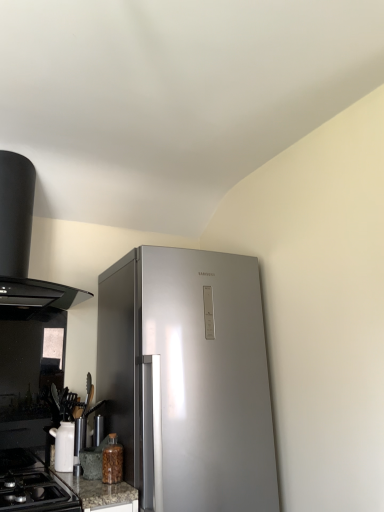
Question: From the image's perspective, is translucent glass jar at lower left above or below black matte range hood at upper left?

Choices:
 (A) above
 (B) below

Answer: (B)

Question: Is translucent glass jar at lower left in front of or behind black matte range hood at upper left in the image?

Choices:
 (A) behind
 (B) front

Answer: (A)

Question: Considering the real-world distances, which object is closest to the translucent glass jar at lower left?

Choices:
 (A) black glass gas stove at lower left
 (B) white glossy teapot at lower left
 (C) black matte range hood at upper left

Answer: (A)

Question: Considering the real-world distances, which object is farthest from the white glossy teapot at lower left?

Choices:
 (A) black glass gas stove at lower left
 (B) black matte range hood at upper left
 (C) translucent glass jar at lower left

Answer: (B)